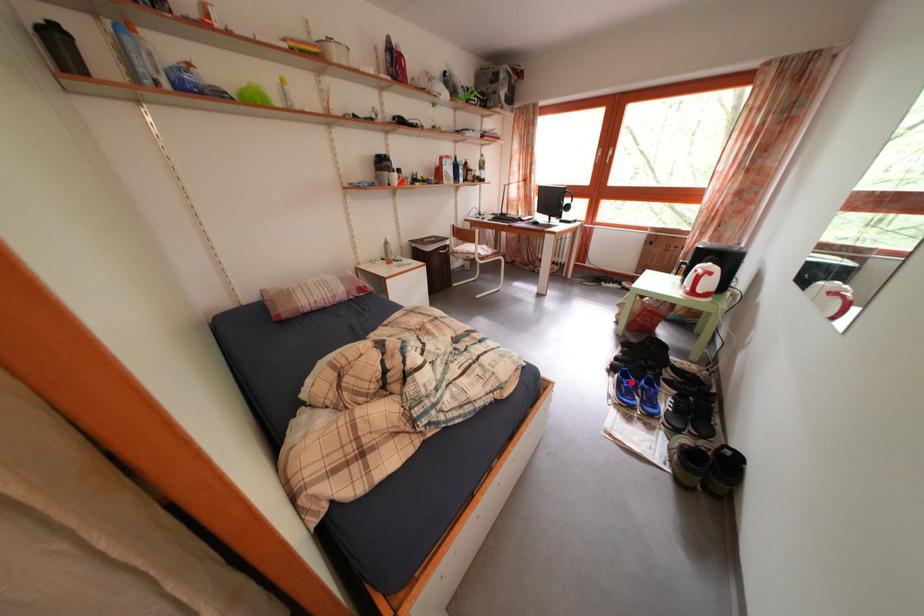
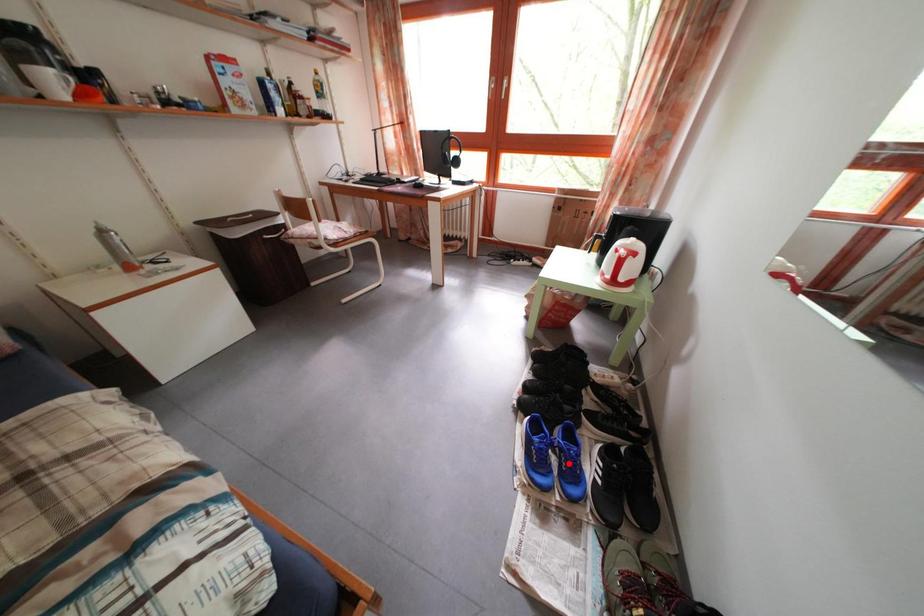
I am providing you with two images of the same scene from different viewpoints. A red point is marked on the first image and another point is marked on the second image. Do the highlighted points in image1 and image2 indicate the same real-world spot?

No